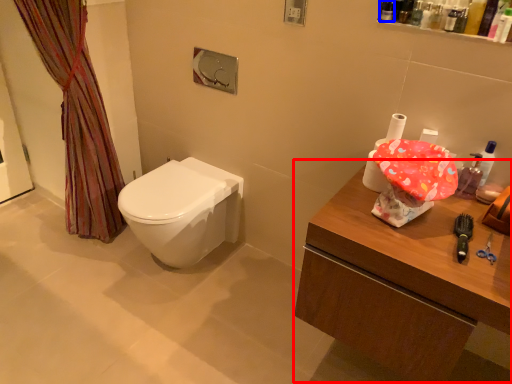
Question: Which point is further to the camera, counter (highlighted by a red box) or toiletry (highlighted by a blue box)?

Choices:
 (A) counter
 (B) toiletry

Answer: (B)